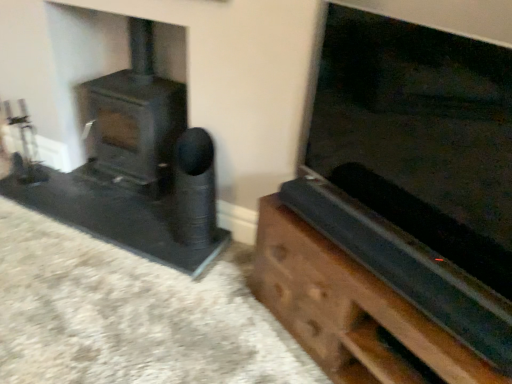
Where is `vacant region to the left of matte black wood burning stove at left`? vacant region to the left of matte black wood burning stove at left is located at coordinates (73, 188).